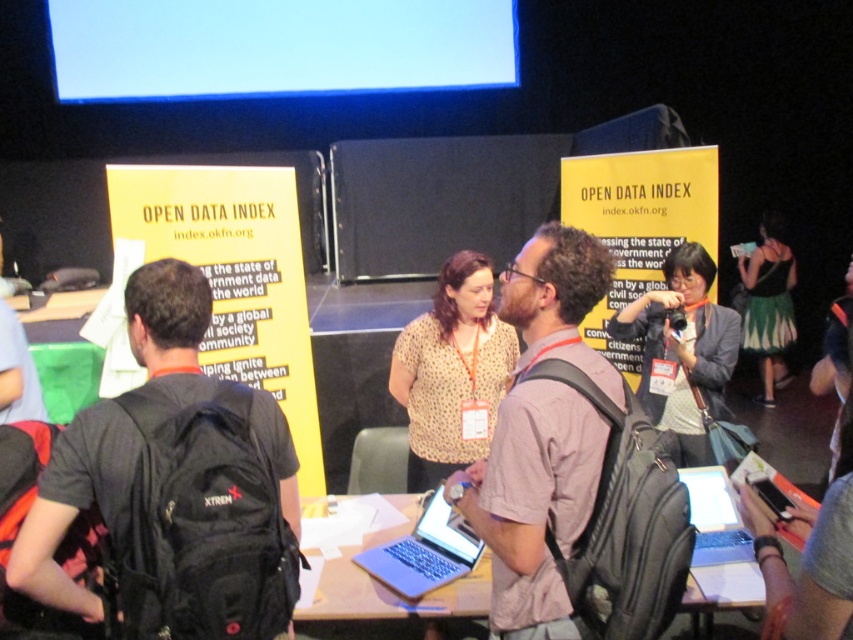
You are organizing a small workshop and need to determine if the silver metallic table at center can fit in a space that is currently occupied by the green textured dress at right. Based on the scene description, will the table fit?

The silver metallic table at center occupies less space than the green textured dress at right, so it will fit in the space currently occupied by the green textured dress at right.

You are a photographer at the event and need to access your laptop to review photos. The black fabric camera at center and the slate gray laptop at center are both on the table. Which object should you move first to reach the laptop?

The black fabric camera at center is positioned over the slate gray laptop at center, so you should move the black fabric camera at center first to access the laptop.

You are organizing a small workshop and need to move a 5 meter long projector screen between the silver metallic table at center and the green textured dress at right. Can the screen fit in the space between them?

The distance between the silver metallic table at center and the green textured dress at right is 4.55 meters. Since the projector screen is 5 meters long, it cannot fit in the space between them as the distance is shorter than the screen.